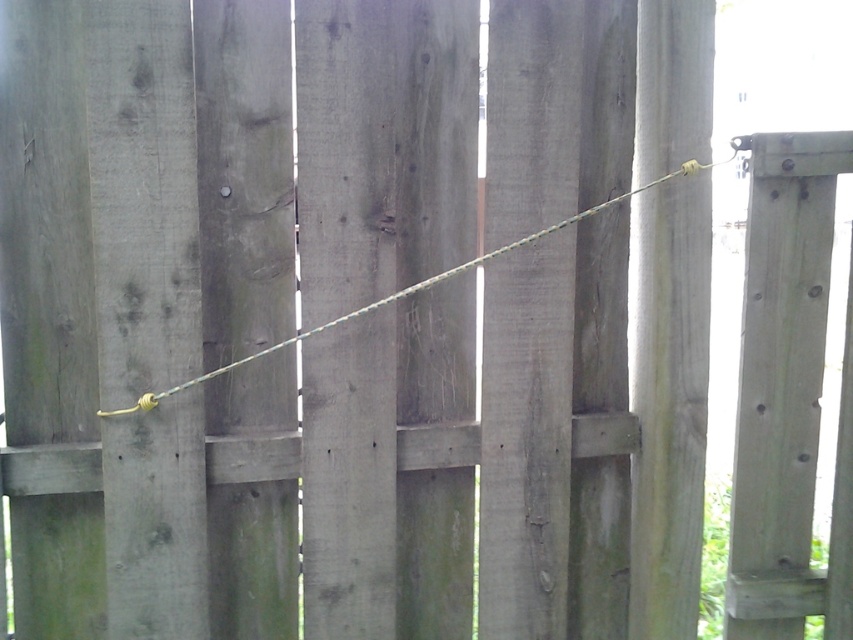
Question: Which point is farther from the camera taking this photo?

Choices:
 (A) (688, 81)
 (B) (396, 296)

Answer: (A)

Question: Is gray wood pole at right positioned before green rope at center?

Choices:
 (A) no
 (B) yes

Answer: (A)

Question: Which point is farther from the camera taking this photo?

Choices:
 (A) (682, 280)
 (B) (354, 316)

Answer: (A)

Question: Can you confirm if gray wood pole at right is wider than green rope at center?

Choices:
 (A) yes
 (B) no

Answer: (B)

Question: Can you confirm if gray wood pole at right is positioned to the right of green rope at center?

Choices:
 (A) yes
 (B) no

Answer: (A)